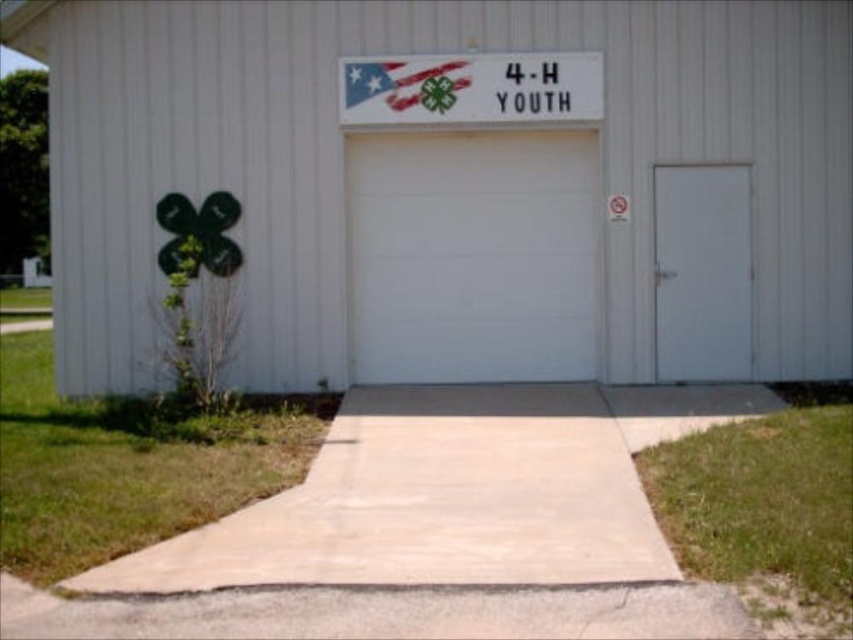
Is white smooth garage door at center wider than white matte door at center?

Correct, the width of white smooth garage door at center exceeds that of white matte door at center.

Is white smooth garage door at center positioned at the back of white matte door at center?

Yes, white smooth garage door at center is further from the viewer.

Which is in front, point (428, 243) or point (670, 308)?

Point (670, 308) is more forward.

The image size is (853, 640). Identify the location of white smooth garage door at center. (473, 256).

Is point (109, 385) farther from viewer compared to point (410, 362)?

That is False.

Does point (511, 128) come closer to viewer compared to point (393, 262)?

Yes.

Image resolution: width=853 pixels, height=640 pixels. In order to click on white matte garage door at center in this screenshot , I will do `click(457, 186)`.

Who is positioned more to the right, white matte garage door at center or white matte door at center?

white matte door at center is more to the right.

Can you confirm if white matte garage door at center is wider than white matte door at center?

Yes.

Where is `white matte garage door at center`? white matte garage door at center is located at coordinates (457, 186).

Where is `white matte garage door at center`? The image size is (853, 640). white matte garage door at center is located at coordinates (457, 186).